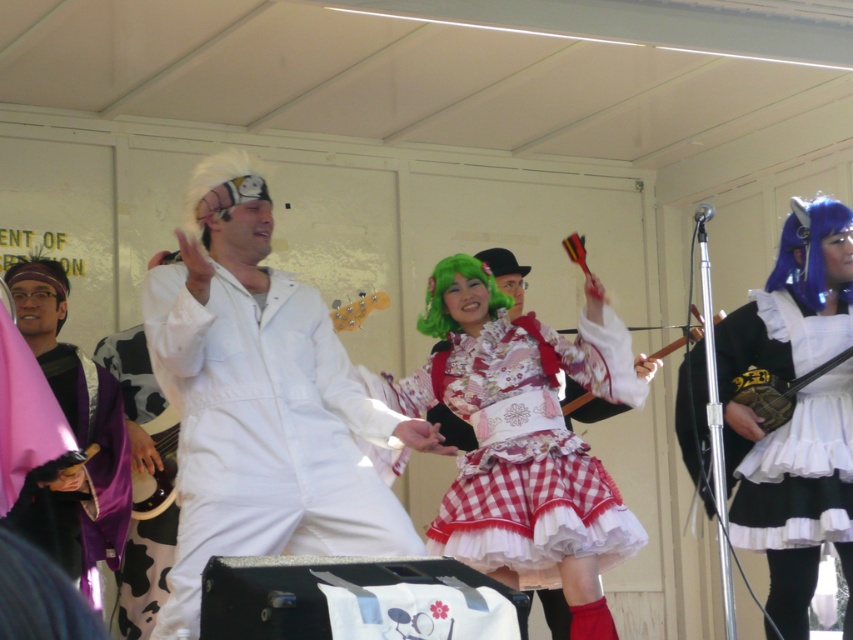
Who is more distant from viewer, [270,493] or [122,492]?

Positioned behind is point [122,492].

Is white matte jumpsuit at center below purple velvet robe at left?

No.

Locate an element on the screen. The image size is (853, 640). white matte jumpsuit at center is located at coordinates (262, 401).

Is white matte jumpsuit at center above gingham fabric dress at center?

Yes.

Based on the photo, which is more to the left, white matte jumpsuit at center or gingham fabric dress at center?

Positioned to the left is white matte jumpsuit at center.

Where is `white matte jumpsuit at center`? This screenshot has width=853, height=640. white matte jumpsuit at center is located at coordinates pos(262,401).

Measure the distance between gingham fabric dress at center and camera.

8.06 meters

Between gingham fabric dress at center and black satin dress at right, which one is positioned higher?

Positioned higher is black satin dress at right.

Is point (525, 563) positioned after point (815, 436)?

No, it is in front of (815, 436).

Where is `gingham fabric dress at center`? The image size is (853, 640). gingham fabric dress at center is located at coordinates (525, 438).